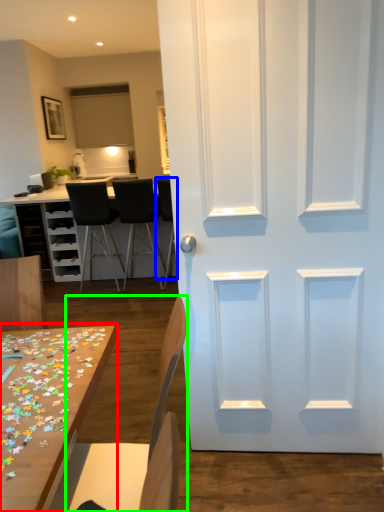
Question: Estimate the real-world distances between objects in this image. Which object is farther from table (highlighted by a red box), chair (highlighted by a blue box) or chair (highlighted by a green box)?

Choices:
 (A) chair
 (B) chair

Answer: (A)